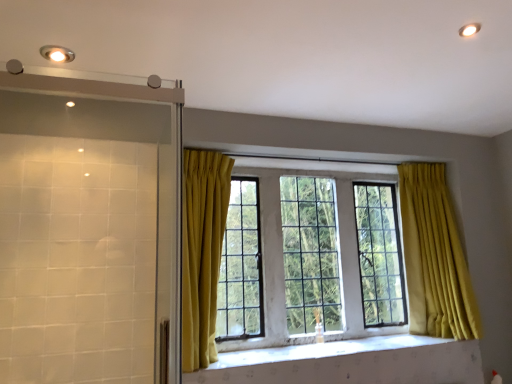
Find the location of `unoccupied area behind white glossy light fixture at upper right`. unoccupied area behind white glossy light fixture at upper right is located at coordinates (456, 49).